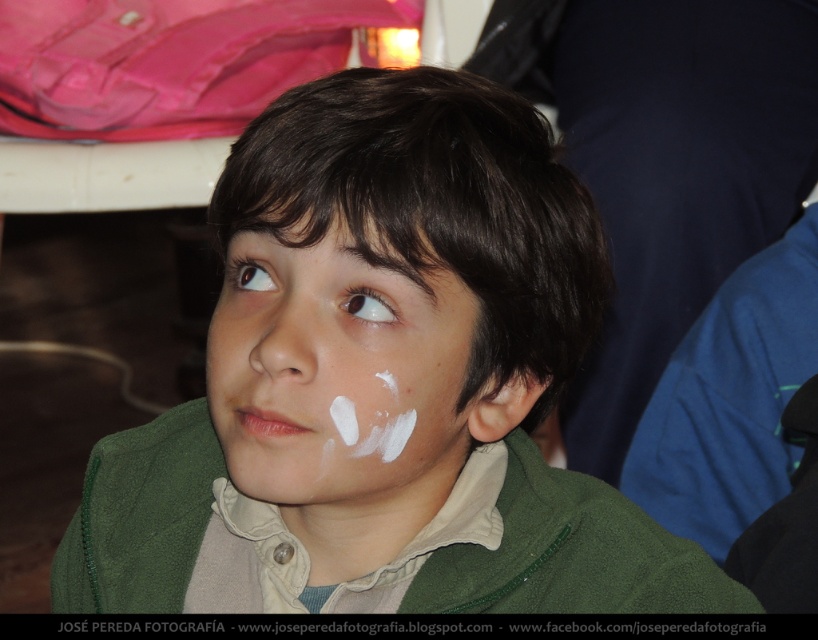
Does white matte face at center have a greater width compared to brown glossy eye at upper left?

Yes, white matte face at center is wider than brown glossy eye at upper left.

Does white matte face at center have a lesser height compared to brown glossy eye at upper left?

No.

Describe the element at coordinates (340, 380) in the screenshot. I see `white matte face at center` at that location.

Locate an element on the screen. This screenshot has height=640, width=818. white matte face at center is located at coordinates (340, 380).

Is point (219, 404) closer to viewer compared to point (268, 381)?

No, it is not.

Which is more to the left, white matte face at center or smooth white nose at center?

smooth white nose at center is more to the left.

The image size is (818, 640). Find the location of `white matte face at center`. white matte face at center is located at coordinates (340, 380).

Locate an element on the screen. white matte face at center is located at coordinates (340, 380).

Is smooth white nose at center further to the viewer compared to dark brown hair at upper center?

Yes, smooth white nose at center is further from the viewer.

Is point (263, 380) farther from camera compared to point (376, 212)?

That is True.

Is point (281, 362) in front of point (344, 205)?

Yes, point (281, 362) is in front of point (344, 205).

Image resolution: width=818 pixels, height=640 pixels. I want to click on smooth white nose at center, so click(x=281, y=333).